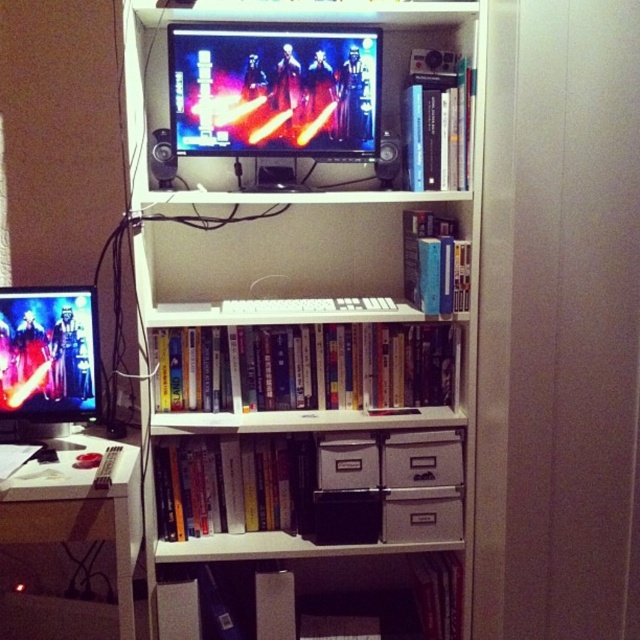
Which is in front, point (13, 364) or point (328, 486)?

Positioned in front is point (13, 364).

Between matte black monitor at left and white plastic drawer at center, which one is positioned lower?

Positioned lower is white plastic drawer at center.

What do you see at coordinates (48, 358) in the screenshot? I see `matte black monitor at left` at bounding box center [48, 358].

At what (x,y) coordinates should I click in order to perform the action: click on matte black monitor at left. Please return your answer as a coordinate pair (x, y). This screenshot has width=640, height=640. Looking at the image, I should click on (48, 358).

Who is lower down, matte black monitor at upper center or white plastic drawer at center?

white plastic drawer at center is below.

Is point (324, 44) positioned in front of point (323, 449)?

Yes, it is in front of point (323, 449).

Locate an element on the screen. This screenshot has height=640, width=640. matte black monitor at upper center is located at coordinates (275, 90).

Which is behind, point (451, 132) or point (388, 467)?

The point (388, 467) is behind.

Can you confirm if white matte bookcase at upper center is positioned below white cardboard drawers at center?

No.

The width and height of the screenshot is (640, 640). What do you see at coordinates (301, 323) in the screenshot? I see `white matte bookcase at upper center` at bounding box center [301, 323].

Image resolution: width=640 pixels, height=640 pixels. What are the coordinates of `white matte bookcase at upper center` in the screenshot? It's located at (301, 323).